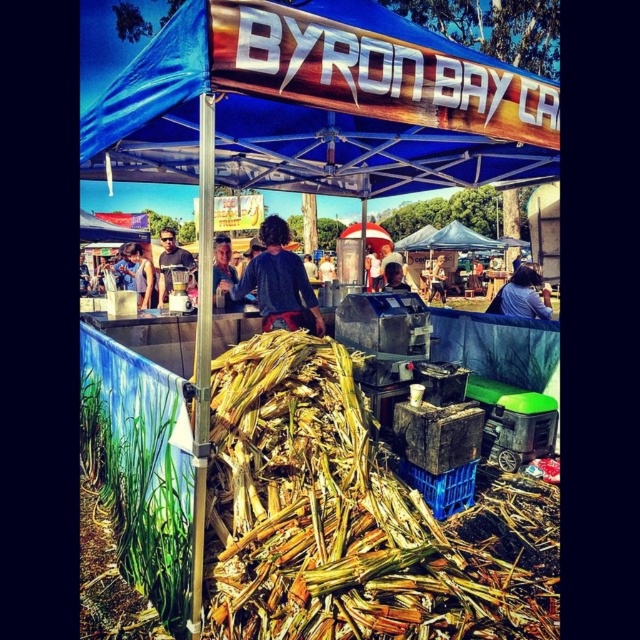
Who is lower down, matte black shirt at center or smooth skin person at center?

Positioned lower is matte black shirt at center.

In the scene shown: Between matte black shirt at center and smooth skin person at center, which one appears on the left side from the viewer's perspective?

matte black shirt at center

Measure the distance between point (147,259) and camera.

The distance of point (147,259) from camera is 14.71 meters.

Find the location of a particular element. Image resolution: width=640 pixels, height=640 pixels. matte black shirt at center is located at coordinates (138, 273).

Is matte black shirt at center thinner than matte black blender at center?

Indeed, matte black shirt at center has a lesser width compared to matte black blender at center.

Between matte black shirt at center and matte black blender at center, which one is positioned higher?

Positioned higher is matte black blender at center.

Image resolution: width=640 pixels, height=640 pixels. I want to click on matte black shirt at center, so click(138, 273).

Does brown/crumbly corn at center have a lesser height compared to matte black shirt at center?

Indeed, brown/crumbly corn at center has a lesser height compared to matte black shirt at center.

The height and width of the screenshot is (640, 640). What do you see at coordinates (353, 518) in the screenshot? I see `brown/crumbly corn at center` at bounding box center [353, 518].

The width and height of the screenshot is (640, 640). Identify the location of brown/crumbly corn at center. (353, 518).